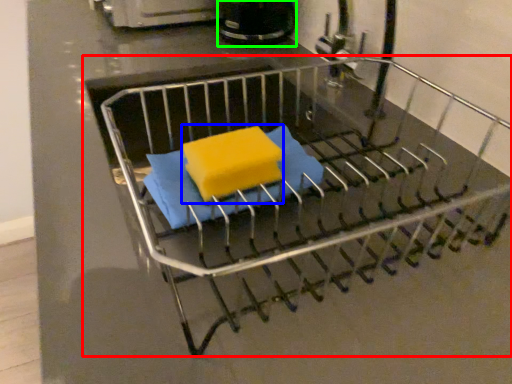
Question: Which object is the farthest from furniture (highlighted by a red box)? Choose among these: cheese (highlighted by a blue box) or appliance (highlighted by a green box).

Choices:
 (A) cheese
 (B) appliance

Answer: (B)